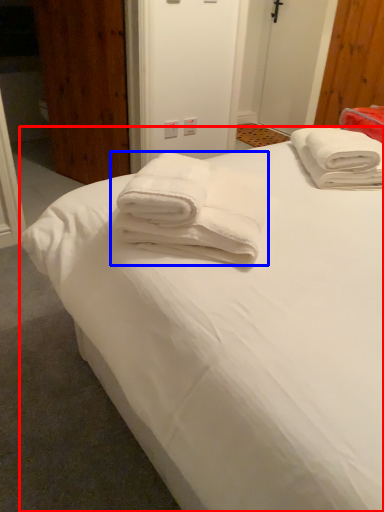
Question: Which point is closer to the camera, bed (highlighted by a red box) or towel (highlighted by a blue box)?

Choices:
 (A) bed
 (B) towel

Answer: (A)